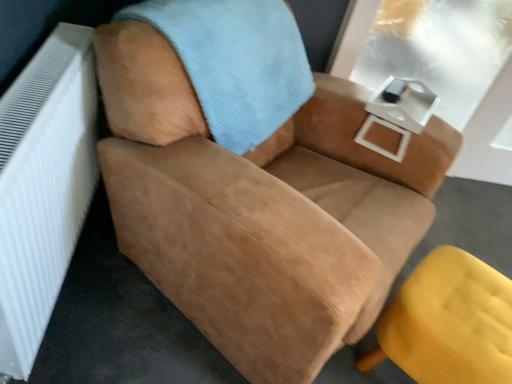
Question: From a real-world perspective, is matte yellow ottoman at lower right, which is counted as the 1th chair, starting from the bottom, located higher than suede tan chair at center, the 1th chair in the top-to-bottom sequence?

Choices:
 (A) no
 (B) yes

Answer: (A)

Question: Is matte yellow ottoman at lower right, which is counted as the 1th chair, starting from the bottom, completely or partially outside of suede tan chair at center, the 1th chair in the top-to-bottom sequence?

Choices:
 (A) no
 (B) yes

Answer: (B)

Question: From the image's perspective, is matte yellow ottoman at lower right, which is counted as the 1th chair, starting from the bottom, over suede tan chair at center, the 1th chair in the top-to-bottom sequence?

Choices:
 (A) no
 (B) yes

Answer: (A)

Question: From a real-world perspective, is matte yellow ottoman at lower right, which is counted as the 1th chair, starting from the bottom, positioned under suede tan chair at center, the second chair from the bottom, based on gravity?

Choices:
 (A) yes
 (B) no

Answer: (A)

Question: Considering the relative sizes of matte yellow ottoman at lower right, which is counted as the 1th chair, starting from the bottom, and suede tan chair at center, the 1th chair in the top-to-bottom sequence, in the image provided, is matte yellow ottoman at lower right, which is counted as the 1th chair, starting from the bottom, shorter than suede tan chair at center, the 1th chair in the top-to-bottom sequence,?

Choices:
 (A) no
 (B) yes

Answer: (B)

Question: Does matte yellow ottoman at lower right, which is the 2th chair from top to bottom, have a larger size compared to suede tan chair at center, the second chair from the bottom?

Choices:
 (A) yes
 (B) no

Answer: (B)

Question: Can you confirm if suede tan chair at center, the 1th chair in the top-to-bottom sequence, is thinner than matte yellow ottoman at lower right, which is counted as the 1th chair, starting from the bottom?

Choices:
 (A) no
 (B) yes

Answer: (A)

Question: Is suede tan chair at center, the 1th chair in the top-to-bottom sequence, not within matte yellow ottoman at lower right, which is counted as the 1th chair, starting from the bottom?

Choices:
 (A) yes
 (B) no

Answer: (A)

Question: Does suede tan chair at center, the second chair from the bottom, turn towards matte yellow ottoman at lower right, which is counted as the 1th chair, starting from the bottom?

Choices:
 (A) no
 (B) yes

Answer: (B)

Question: Is suede tan chair at center, the second chair from the bottom, to the left of matte yellow ottoman at lower right, which is the 2th chair from top to bottom, from the viewer's perspective?

Choices:
 (A) yes
 (B) no

Answer: (A)

Question: Does suede tan chair at center, the 1th chair in the top-to-bottom sequence, appear on the right side of matte yellow ottoman at lower right, which is counted as the 1th chair, starting from the bottom?

Choices:
 (A) yes
 (B) no

Answer: (B)

Question: Does suede tan chair at center, the 1th chair in the top-to-bottom sequence, have a larger size compared to matte yellow ottoman at lower right, which is the 2th chair from top to bottom?

Choices:
 (A) no
 (B) yes

Answer: (B)

Question: Does white glossy table at upper right have a lesser width compared to white textured radiator at left?

Choices:
 (A) no
 (B) yes

Answer: (A)